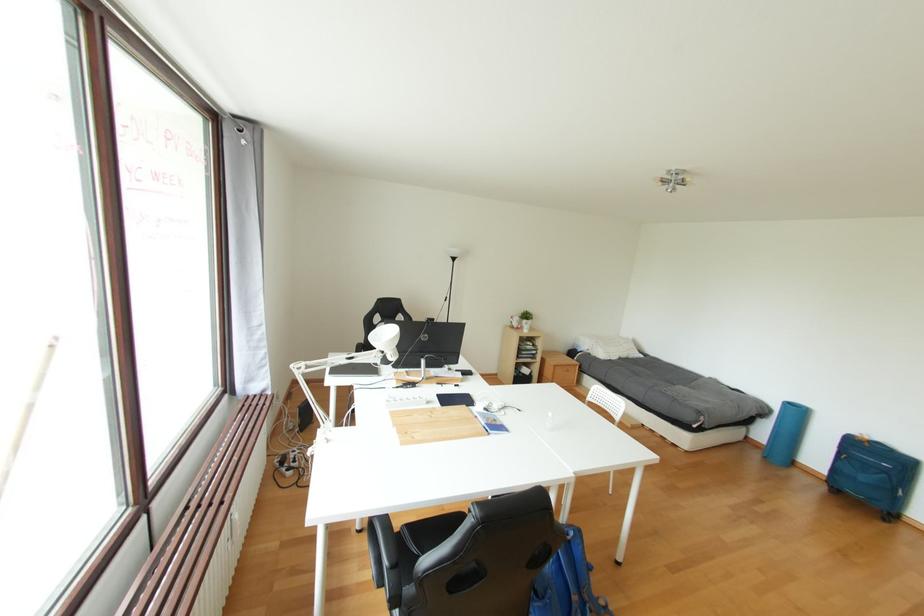
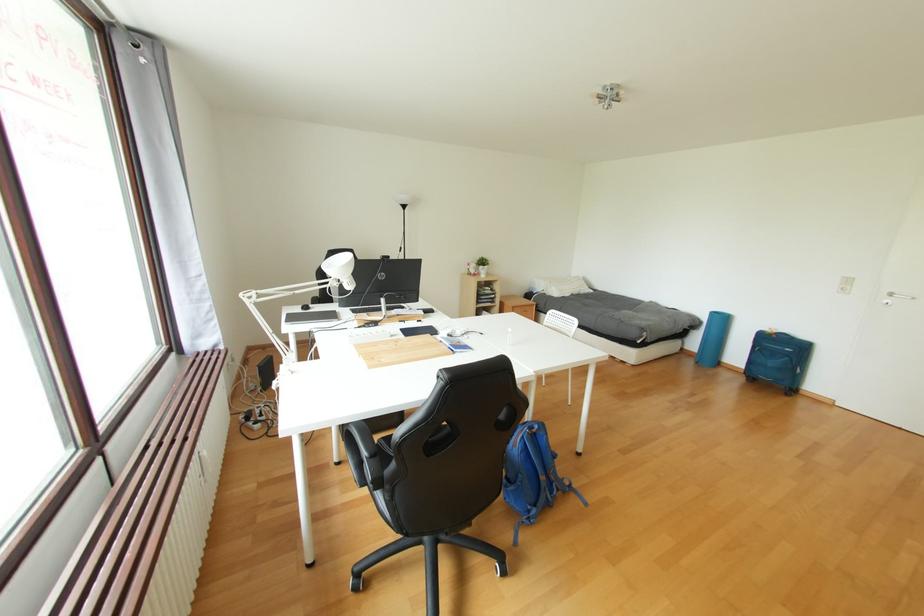
Question: The images are taken continuously from a first-person perspective. In which direction are you moving?

Choices:
 (A) Left
 (B) Right
 (C) Forward
 (D) Backward

Answer: (D)